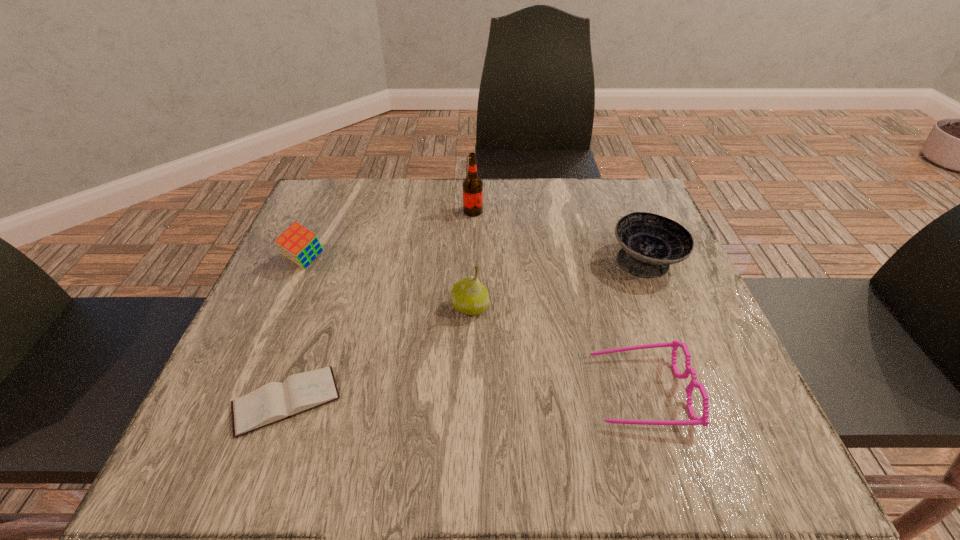
Find the location of a particular element. The image size is (960, 540). empty location between the spectacles and the pear is located at coordinates (555, 349).

Locate an element on the screen. object that is the second closest to the farthest object is located at coordinates (650, 243).

Identify which object is the fifth closest to the second shortest object. Please provide its 2D coordinates. Your answer should be formatted as a tuple, i.e. [(x, y)], where the tuple contains the x and y coordinates of a point satisfying the conditions above.

[(298, 244)]

At what (x,y) coordinates should I click in order to perform the action: click on free space in the image that satisfies the following two spatial constraints: 1. on the front side of the bowl; 2. on the left side of the cube. Please return your answer as a coordinate pair (x, y). Looking at the image, I should click on (304, 261).

At what (x,y) coordinates should I click in order to perform the action: click on blank space that satisfies the following two spatial constraints: 1. on the front side of the cube; 2. on the right side of the bowl. Please return your answer as a coordinate pair (x, y). The image size is (960, 540). Looking at the image, I should click on (304, 261).

Locate an element on the screen. This screenshot has height=540, width=960. blank space that satisfies the following two spatial constraints: 1. on the back side of the root beer; 2. on the left side of the second tallest object is located at coordinates (472, 211).